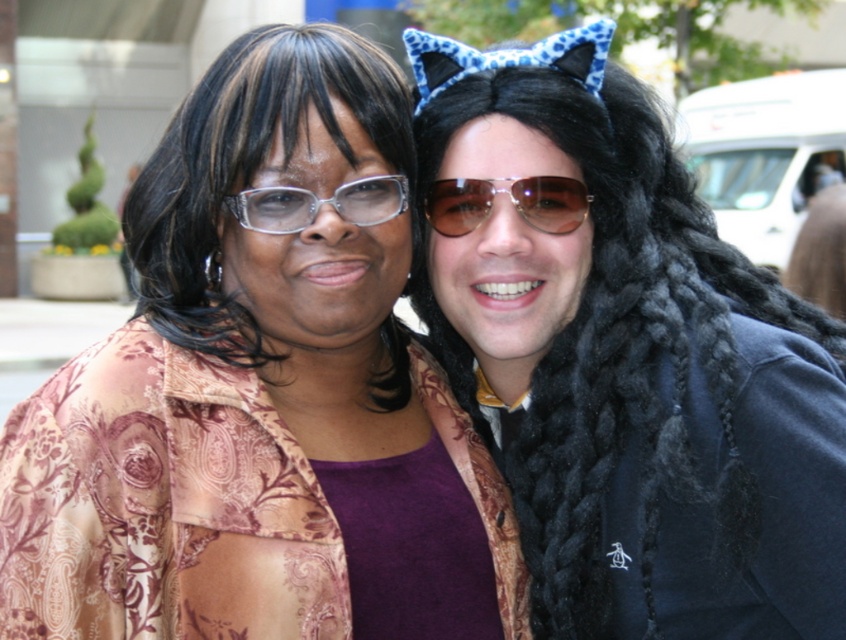
Is the position of brown paisley jacket at upper left less distant than that of blue leopard print cat ears at upper center?

Yes, brown paisley jacket at upper left is closer to the viewer.

Measure the distance between brown paisley jacket at upper left and blue leopard print cat ears at upper center.

brown paisley jacket at upper left is 5.03 feet away from blue leopard print cat ears at upper center.

What are the coordinates of `brown paisley jacket at upper left` in the screenshot? It's located at (259, 397).

Identify the location of brown paisley jacket at upper left. This screenshot has height=640, width=846. (259, 397).

Between black silky hair at upper left and brown reflective aviator sunglasses at center, which one appears on the left side from the viewer's perspective?

From the viewer's perspective, black silky hair at upper left appears more on the left side.

Can you confirm if black silky hair at upper left is positioned to the left of brown reflective aviator sunglasses at center?

Correct, you'll find black silky hair at upper left to the left of brown reflective aviator sunglasses at center.

The width and height of the screenshot is (846, 640). What are the coordinates of `black silky hair at upper left` in the screenshot? It's located at tap(246, 168).

Can you confirm if brown paisley jacket at upper left is wider than black silky hair at upper left?

Yes.

Is brown paisley jacket at upper left shorter than black silky hair at upper left?

In fact, brown paisley jacket at upper left may be taller than black silky hair at upper left.

Where is `brown paisley jacket at upper left`? This screenshot has height=640, width=846. brown paisley jacket at upper left is located at coordinates (259, 397).

Locate an element on the screen. The width and height of the screenshot is (846, 640). brown paisley jacket at upper left is located at coordinates (259, 397).